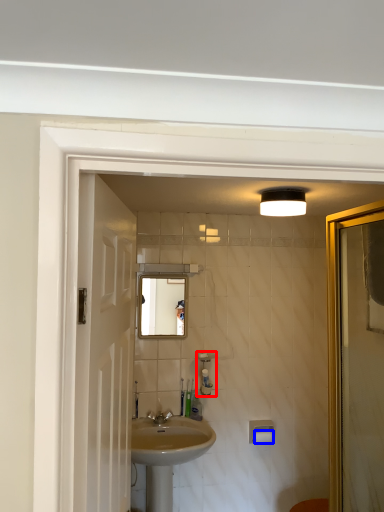
Question: Which object appears closest to the camera in this image, soap dispenser (highlighted by a red box) or toilet paper (highlighted by a blue box)?

Choices:
 (A) soap dispenser
 (B) toilet paper

Answer: (A)